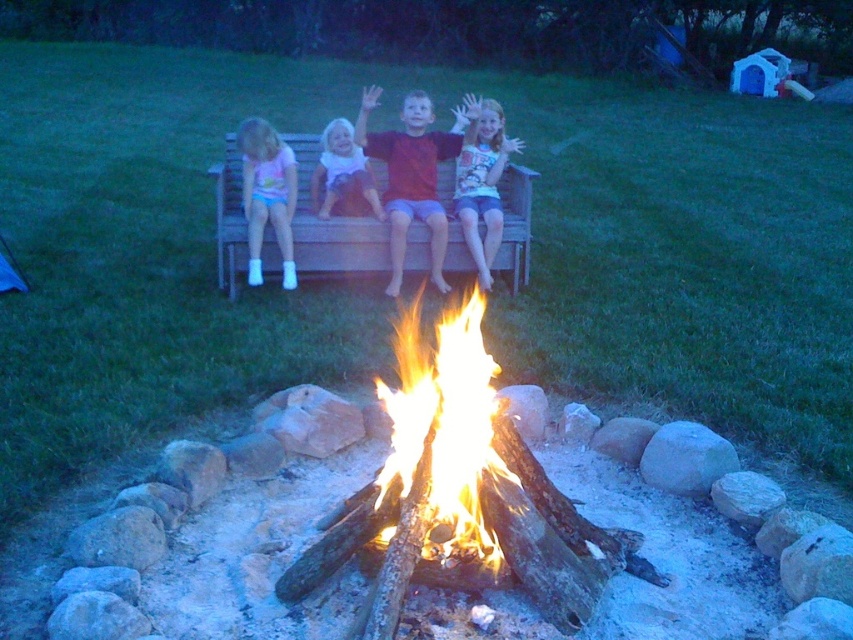
Which is above, flaming wood at center or matte red shirt at center?

matte red shirt at center is higher up.

Is point (404, 488) positioned behind point (415, 100)?

No, it is not.

This screenshot has height=640, width=853. What are the coordinates of `flaming wood at center` in the screenshot? It's located at (442, 422).

Between point (401, 209) and point (280, 202), which one is positioned in front?

Point (280, 202)

From the picture: Which is below, matte red shirt at center or matte pink shorts at left?

matte pink shorts at left is below.

This screenshot has width=853, height=640. What are the coordinates of `matte red shirt at center` in the screenshot? It's located at click(410, 177).

Is point (426, 412) less distant than point (274, 202)?

That is True.

What do you see at coordinates (442, 422) in the screenshot? This screenshot has height=640, width=853. I see `flaming wood at center` at bounding box center [442, 422].

I want to click on flaming wood at center, so click(442, 422).